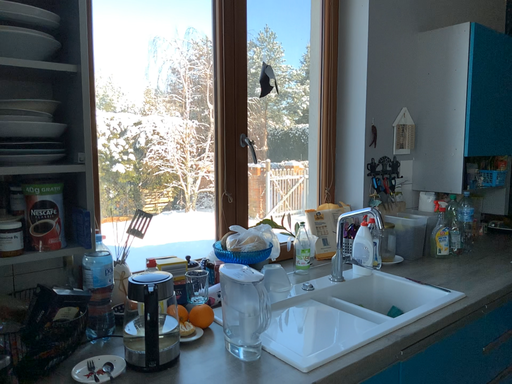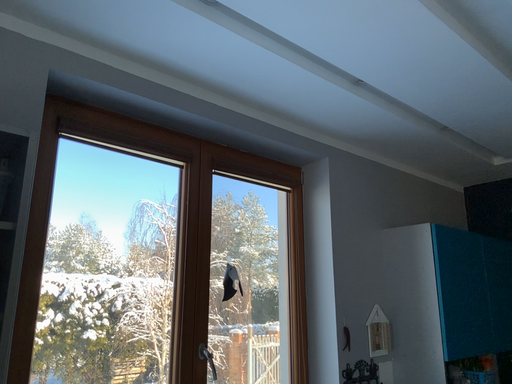
Question: How did the camera likely rotate when shooting the video?

Choices:
 (A) rotated downward
 (B) rotated upward

Answer: (B)